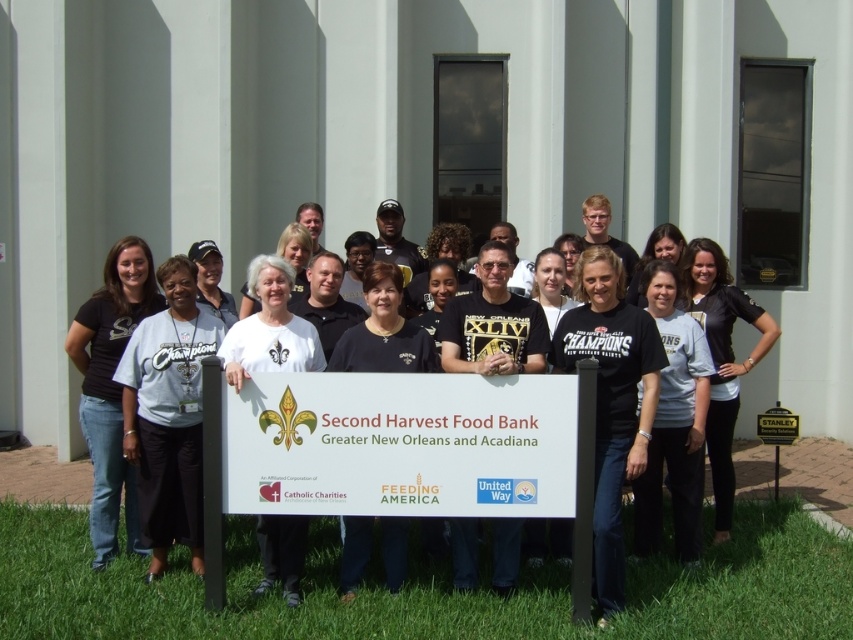
Question: Which point appears farthest from the camera in this image?

Choices:
 (A) (x=610, y=456)
 (B) (x=674, y=412)
 (C) (x=519, y=435)

Answer: (B)

Question: Is white matte sign at center bigger than gray t-shirt at lower left?

Choices:
 (A) no
 (B) yes

Answer: (B)

Question: Which object is the farthest from the gray t-shirt at lower left?

Choices:
 (A) black matte t-shirt at center
 (B) white matte sign at center
 (C) black t-shirt at left
 (D) black matte shirt at center

Answer: (D)

Question: Is white matte sign at center positioned before black matte shirt at center?

Choices:
 (A) yes
 (B) no

Answer: (A)

Question: Among these objects, which one is nearest to the camera?

Choices:
 (A) white matte t-shirt at center
 (B) white matte sign at center
 (C) black matte t-shirt at center
 (D) black t-shirt at left

Answer: (B)

Question: Considering the relative positions of black t-shirt at left and black matte shirt at center in the image provided, where is black t-shirt at left located with respect to black matte shirt at center?

Choices:
 (A) above
 (B) below

Answer: (B)